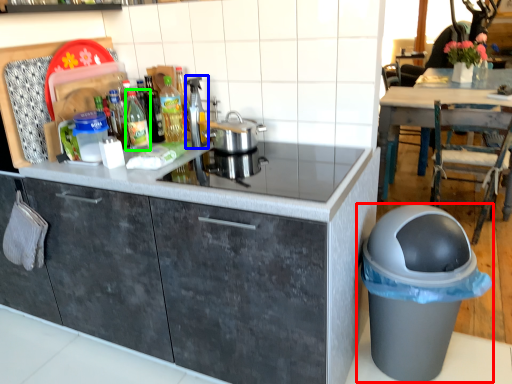
Question: Estimate the real-world distances between objects in this image. Which object is farther from waste container (highlighted by a red box), appliance (highlighted by a blue box) or bottle (highlighted by a green box)?

Choices:
 (A) appliance
 (B) bottle

Answer: (B)